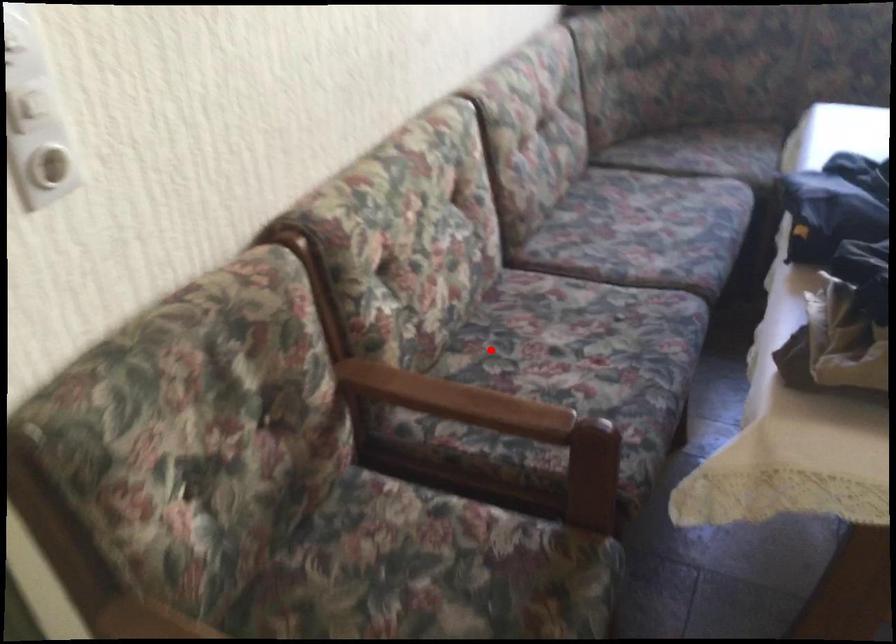
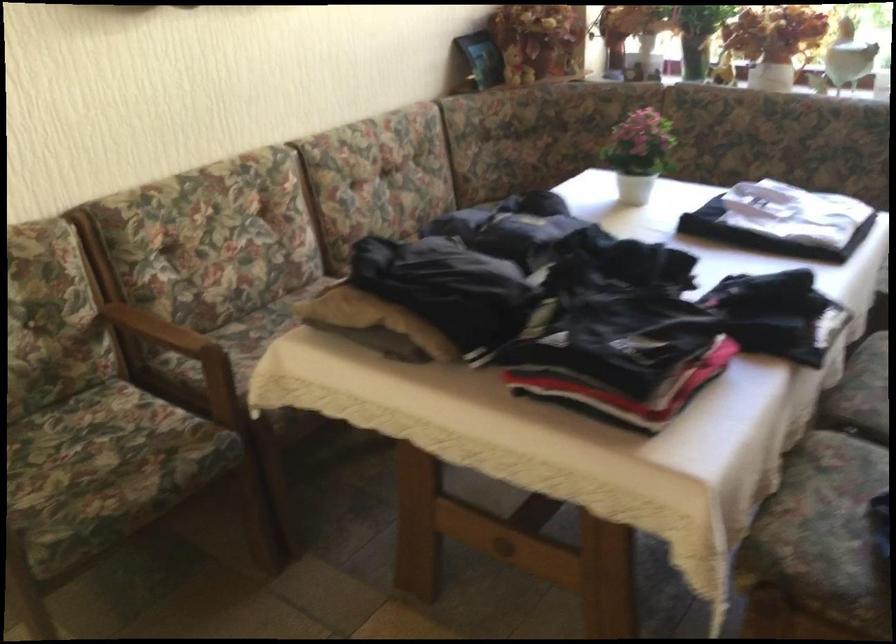
The point at the highlighted location is marked in the first image. Where is the corresponding point in the second image?

(263, 324)